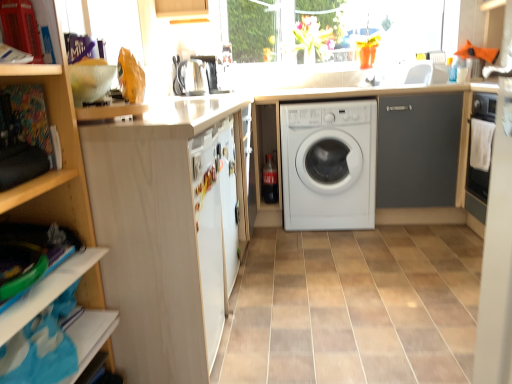
Question: Is satin silver coffee machine at upper center situated inside white matte refrigerator at center or outside?

Choices:
 (A) outside
 (B) inside

Answer: (A)

Question: Considering the positions of satin silver coffee machine at upper center and white matte refrigerator at center in the image, is satin silver coffee machine at upper center wider or thinner than white matte refrigerator at center?

Choices:
 (A) wide
 (B) thin

Answer: (A)

Question: Based on their relative distances, which object is farther from the satin silver kettle at upper center?

Choices:
 (A) wooden shelf at upper left
 (B) dark gray matte cabinet at center-right, which is counted as the first cabinetry, starting from the back
 (C) white matte washing machine at center
 (D) translucent glass window at upper center
 (E) white wood cabinet at left, arranged as the 1th cabinetry when viewed from the front

Answer: (A)

Question: Estimate the real-world distances between objects in this image. Which object is farther from the satin silver coffee machine at upper center?

Choices:
 (A) white glossy sink at upper right
 (B) brown ceramic tile at center
 (C) white wood cabinet at left, which is the second cabinetry from right to left
 (D) wooden shelf at upper left
 (E) dark gray matte cabinet at center-right, acting as the second cabinetry starting from the left

Answer: (D)